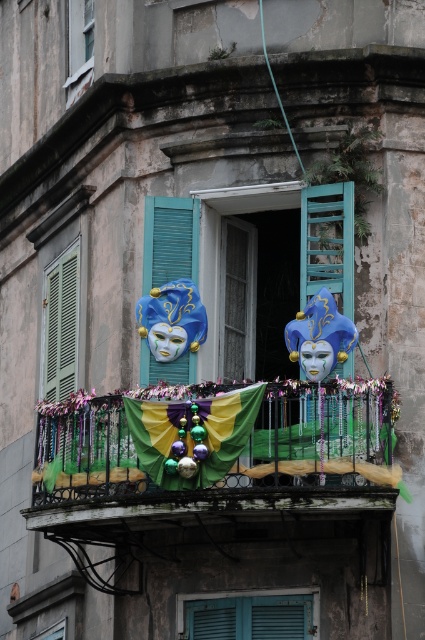
Does shiny metallic banner at center have a lesser height compared to transparent glass window at upper center?

No.

Is shiny metallic banner at center closer to the viewer compared to transparent glass window at upper center?

Yes.

Where is `shiny metallic banner at center`? The width and height of the screenshot is (425, 640). shiny metallic banner at center is located at coordinates (215, 452).

Does teal matte shutters at lower center come in front of blue painted wood at center?

Yes, teal matte shutters at lower center is in front of blue painted wood at center.

Which is in front, point (269, 634) or point (163, 248)?

Point (269, 634) is more forward.

This screenshot has width=425, height=640. In order to click on teal matte shutters at lower center in this screenshot , I will do `click(249, 614)`.

Does blue painted wood at center have a lesser width compared to matte glass window at upper left?

Correct, blue painted wood at center's width is less than matte glass window at upper left's.

Which is below, blue painted wood at center or matte glass window at upper left?

blue painted wood at center

Between point (153, 227) and point (68, 54), which one is positioned behind?

Point (68, 54)

Find the location of a particular element. Image resolution: width=425 pixels, height=640 pixels. blue painted wood at center is located at coordinates (170, 241).